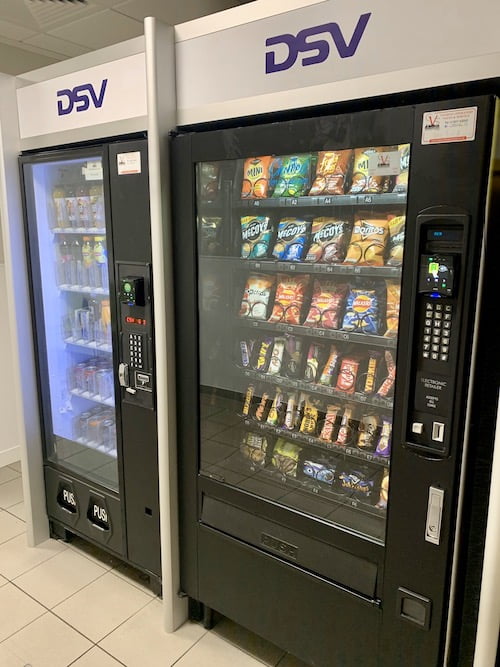
Where is `change (coin) dispenser`? change (coin) dispenser is located at coordinates (405, 605).